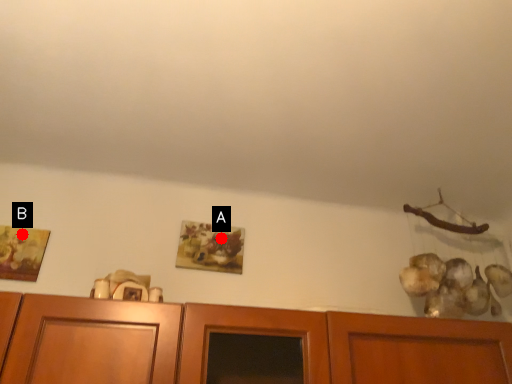
Question: Two points are circled on the image, labeled by A and B beside each circle. Among these points, which one is nearest to the camera?

Choices:
 (A) A is closer
 (B) B is closer

Answer: (B)